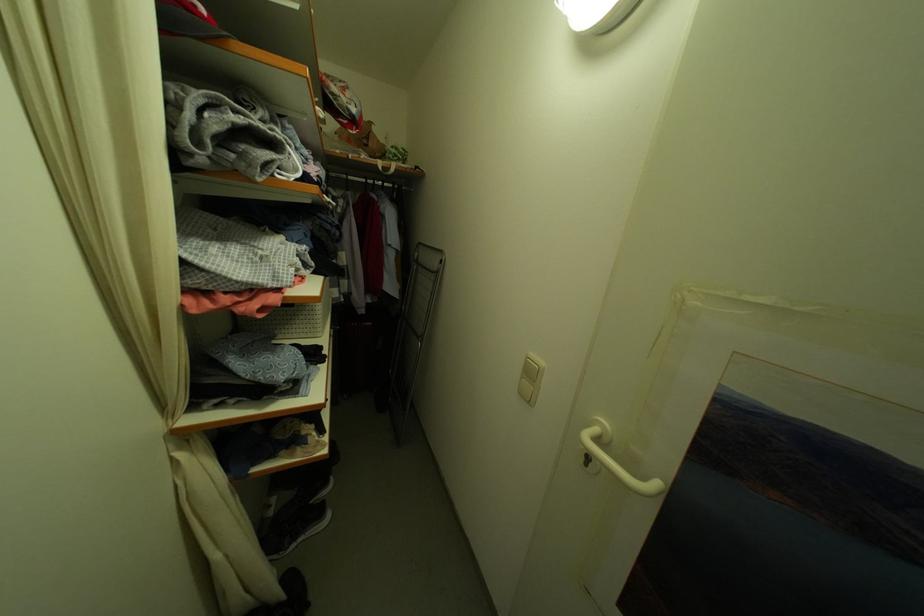
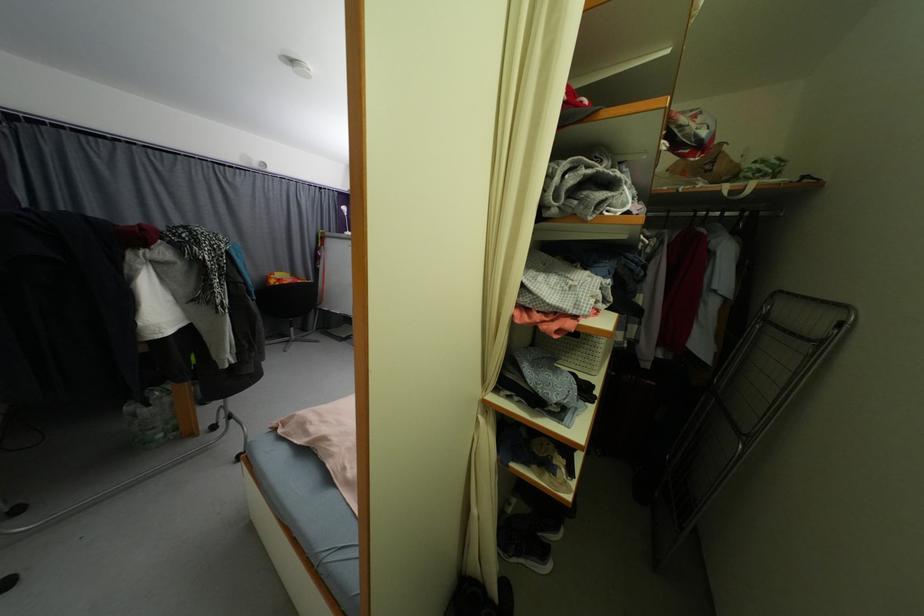
Where in the second image is the point corresponding to (x=300, y=541) from the first image?

(524, 557)